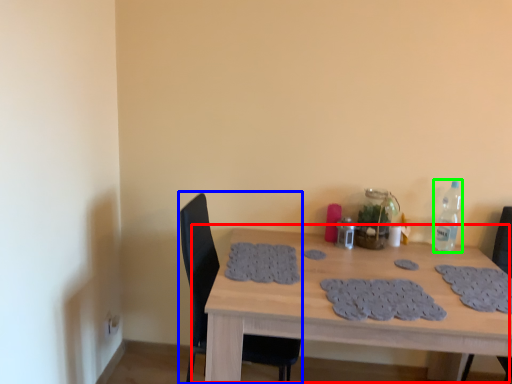
Question: Which is farther away from table (highlighted by a red box)? chair (highlighted by a blue box) or bottle (highlighted by a green box)?

Choices:
 (A) chair
 (B) bottle

Answer: (B)